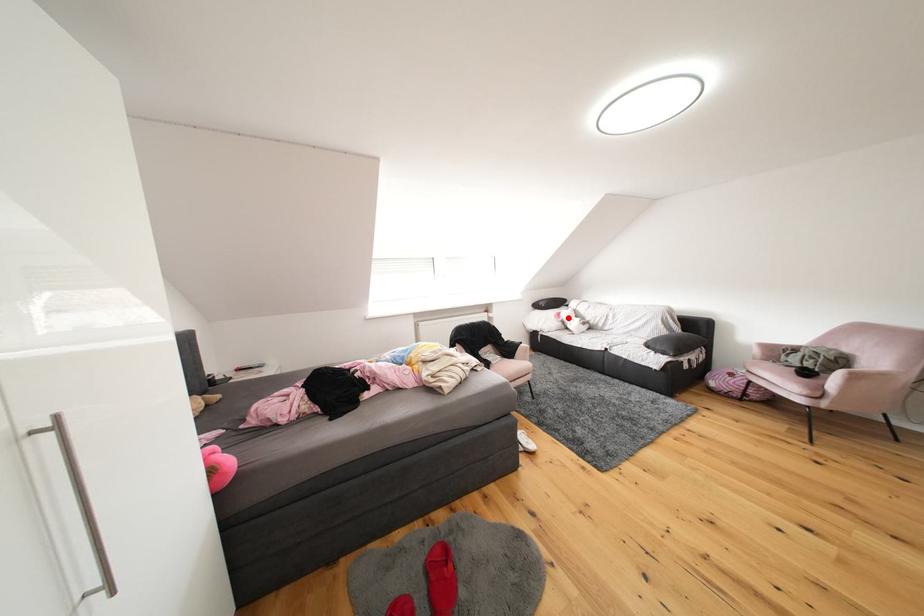
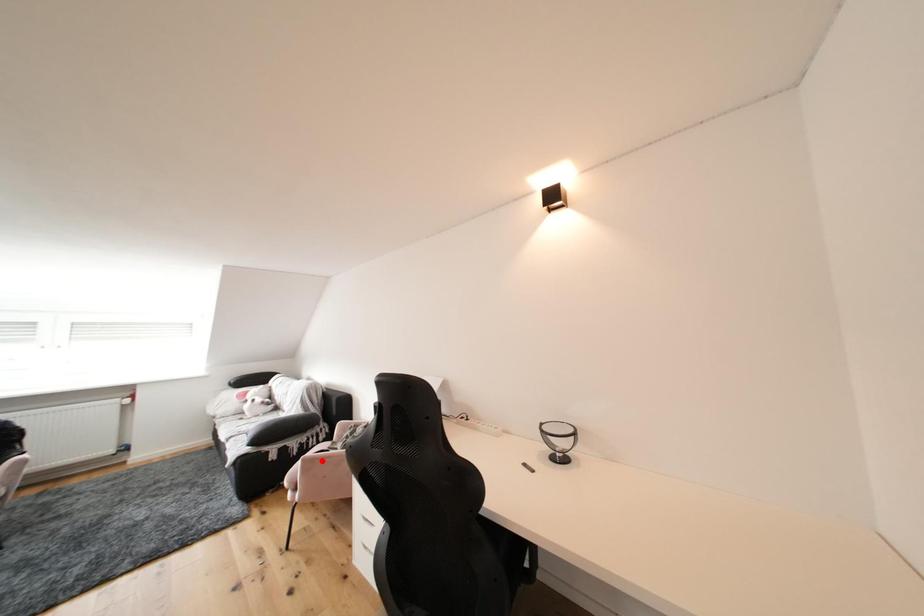
I am providing you with two images of the same scene from different viewpoints. A red point is marked on the first image and another point is marked on the second image. Is the red point in image1 aligned with the point shown in image2?

No